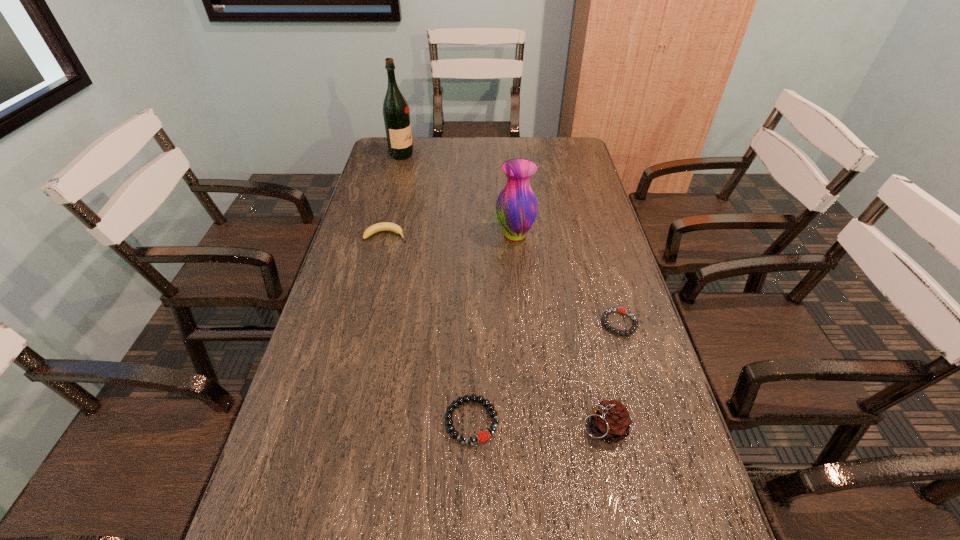
In order to click on the shortest object in this screenshot , I will do `click(633, 328)`.

The height and width of the screenshot is (540, 960). Identify the location of vacant space located on the front-facing side of the liquor. (500, 155).

Where is `vacant area located on the left of the vase`? vacant area located on the left of the vase is located at coordinates (375, 235).

I want to click on free location located 0.200m with a leaf charm attached to the fifth object from left to right, so click(486, 428).

At what (x,y) coordinates should I click in order to perform the action: click on free region located with a leaf charm attached to the fifth object from left to right. Please return your answer as a coordinate pair (x, y). The image size is (960, 540). Looking at the image, I should click on (509, 428).

The height and width of the screenshot is (540, 960). What are the coordinates of `free spot located with a leaf charm attached to the fifth object from left to right` in the screenshot? It's located at 490,428.

Locate an element on the screen. This screenshot has height=540, width=960. vacant space located 0.080m at the stem of the fourth tallest object is located at coordinates (433, 235).

At what (x,y) coordinates should I click in order to perform the action: click on free region located on the left of the taller bracelet. Please return your answer as a coordinate pair (x, y). The height and width of the screenshot is (540, 960). Looking at the image, I should click on (348, 421).

This screenshot has width=960, height=540. What are the coordinates of `vacant space located on the back of the farther bracelet` in the screenshot? It's located at (604, 268).

The height and width of the screenshot is (540, 960). I want to click on object situated at the far edge, so click(396, 115).